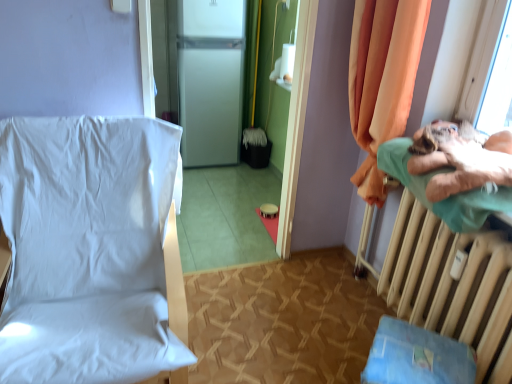
Question: Can you confirm if blue fabric changing table at lower right is smaller than white matte refrigerator at center?

Choices:
 (A) no
 (B) yes

Answer: (B)

Question: Considering the relative sizes of blue fabric changing table at lower right and white matte refrigerator at center in the image provided, is blue fabric changing table at lower right bigger than white matte refrigerator at center?

Choices:
 (A) no
 (B) yes

Answer: (A)

Question: Does blue fabric changing table at lower right have a lesser height compared to white matte refrigerator at center?

Choices:
 (A) yes
 (B) no

Answer: (A)

Question: Does blue fabric changing table at lower right have a greater width compared to white matte refrigerator at center?

Choices:
 (A) yes
 (B) no

Answer: (B)

Question: Does blue fabric changing table at lower right appear on the left side of white matte refrigerator at center?

Choices:
 (A) yes
 (B) no

Answer: (B)

Question: Is blue fabric changing table at lower right further to camera compared to white matte refrigerator at center?

Choices:
 (A) yes
 (B) no

Answer: (B)

Question: Considering the relative sizes of beige metallic radiator at right and blue fabric changing table at lower right in the image provided, is beige metallic radiator at right wider than blue fabric changing table at lower right?

Choices:
 (A) yes
 (B) no

Answer: (B)

Question: Considering the relative positions of beige metallic radiator at right and blue fabric changing table at lower right in the image provided, is beige metallic radiator at right to the right of blue fabric changing table at lower right from the viewer's perspective?

Choices:
 (A) no
 (B) yes

Answer: (B)

Question: Is beige metallic radiator at right oriented away from blue fabric changing table at lower right?

Choices:
 (A) yes
 (B) no

Answer: (B)

Question: Considering the relative sizes of beige metallic radiator at right and blue fabric changing table at lower right in the image provided, is beige metallic radiator at right shorter than blue fabric changing table at lower right?

Choices:
 (A) yes
 (B) no

Answer: (B)

Question: Can you confirm if beige metallic radiator at right is taller than blue fabric changing table at lower right?

Choices:
 (A) no
 (B) yes

Answer: (B)

Question: Is beige metallic radiator at right facing towards blue fabric changing table at lower right?

Choices:
 (A) yes
 (B) no

Answer: (A)

Question: Considering the relative sizes of green fabric pillow at right and white matte refrigerator at center in the image provided, is green fabric pillow at right smaller than white matte refrigerator at center?

Choices:
 (A) no
 (B) yes

Answer: (B)